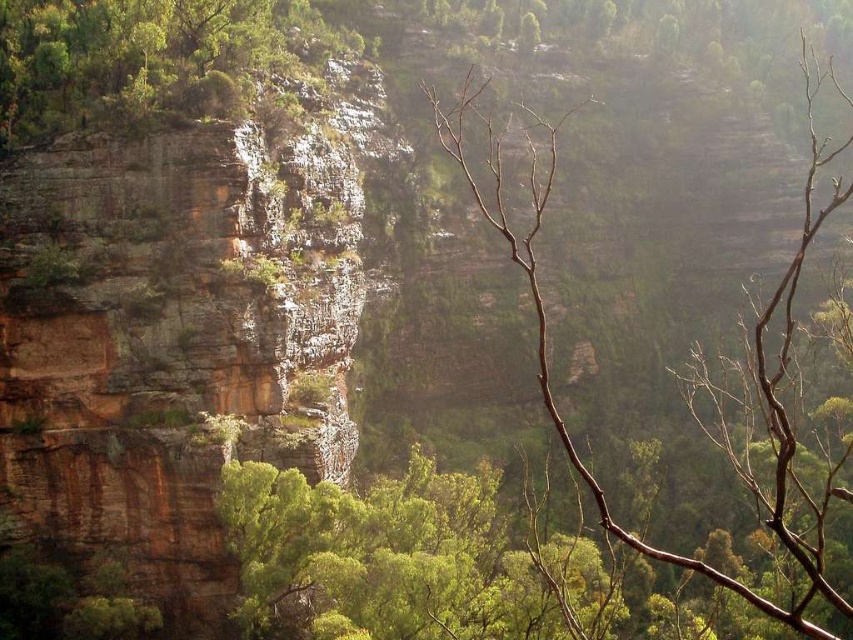
Between rustic stone cliff at center and green leafy shrub at upper left, which one is positioned lower?

rustic stone cliff at center is below.

Does rustic stone cliff at center have a greater height compared to green leafy shrub at upper left?

Correct, rustic stone cliff at center is much taller as green leafy shrub at upper left.

I want to click on rustic stone cliff at center, so click(177, 340).